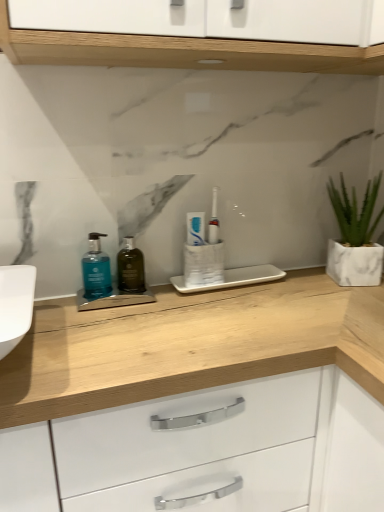
This screenshot has height=512, width=384. What are the coordinates of `white matte tube at center` in the screenshot? It's located at (195, 228).

The height and width of the screenshot is (512, 384). Find the location of `blue matte liquid soap at left, which is the 2th mouthwash in right-to-left order`. blue matte liquid soap at left, which is the 2th mouthwash in right-to-left order is located at coordinates (96, 269).

Describe the element at coordinates (96, 269) in the screenshot. The width and height of the screenshot is (384, 512). I see `blue matte liquid soap at left, which is the 2th mouthwash in right-to-left order` at that location.

I want to click on dark green glass bottle at center, the 1th mouthwash when ordered from right to left, so click(x=130, y=268).

Where is `white matte tube at center`? The height and width of the screenshot is (512, 384). white matte tube at center is located at coordinates (195, 228).

From a real-world perspective, is white marble planter at right above or below blue matte liquid soap at left, which is the first mouthwash in left-to-right order?

From a real-world perspective, white marble planter at right is physically above blue matte liquid soap at left, which is the first mouthwash in left-to-right order.

Is white marble planter at right facing away from blue matte liquid soap at left, which is the 2th mouthwash in right-to-left order?

No, blue matte liquid soap at left, which is the 2th mouthwash in right-to-left order, is not at the back of white marble planter at right.

From the image's perspective, is white marble planter at right over blue matte liquid soap at left, which is the first mouthwash in left-to-right order?

Yes, from the image's perspective, white marble planter at right is above blue matte liquid soap at left, which is the first mouthwash in left-to-right order.

Which of these two, white marble planter at right or blue matte liquid soap at left, which is the first mouthwash in left-to-right order, is smaller?

blue matte liquid soap at left, which is the first mouthwash in left-to-right order, is smaller.

This screenshot has height=512, width=384. I want to click on toothpaste above the blue matte liquid soap at left, which is the first mouthwash in left-to-right order (from the image's perspective), so click(x=195, y=228).

Based on the photo, which object is thinner, blue matte liquid soap at left, which is the first mouthwash in left-to-right order, or white matte tube at center?

white matte tube at center is thinner.

Would you say blue matte liquid soap at left, which is the first mouthwash in left-to-right order, contains white matte tube at center?

No, white matte tube at center is located outside of blue matte liquid soap at left, which is the first mouthwash in left-to-right order.

You are a GUI agent. You are given a task and a screenshot of the screen. Output one action in this format:
    pyautogui.click(x=<x>, y=<y>)
    Task: Click on the mouthwash that is the 1st one below the white marble planter at right (from a real-world perspective)
    Image resolution: width=384 pixels, height=512 pixels.
    Given the screenshot: What is the action you would take?
    pyautogui.click(x=96, y=269)

From their relative heights in the image, would you say blue matte liquid soap at left, which is the 2th mouthwash in right-to-left order, is taller or shorter than white marble planter at right?

In the image, blue matte liquid soap at left, which is the 2th mouthwash in right-to-left order, appears to be shorter than white marble planter at right.

Can you confirm if blue matte liquid soap at left, which is the first mouthwash in left-to-right order, is positioned to the left of white marble planter at right?

Indeed, blue matte liquid soap at left, which is the first mouthwash in left-to-right order, is positioned on the left side of white marble planter at right.

In the image, is dark green glass bottle at center, positioned as the second mouthwash in left-to-right order, on the left side or the right side of blue matte liquid soap at left, which is the first mouthwash in left-to-right order?

Clearly, dark green glass bottle at center, positioned as the second mouthwash in left-to-right order, is on the right of blue matte liquid soap at left, which is the first mouthwash in left-to-right order, in the image.

The width and height of the screenshot is (384, 512). Find the location of `mouthwash located behind the blue matte liquid soap at left, which is the first mouthwash in left-to-right order`. mouthwash located behind the blue matte liquid soap at left, which is the first mouthwash in left-to-right order is located at coordinates (130, 268).

Consider the image. Considering the relative sizes of dark green glass bottle at center, positioned as the second mouthwash in left-to-right order, and blue matte liquid soap at left, which is the 2th mouthwash in right-to-left order, in the image provided, is dark green glass bottle at center, positioned as the second mouthwash in left-to-right order, thinner than blue matte liquid soap at left, which is the 2th mouthwash in right-to-left order,?

Correct, the width of dark green glass bottle at center, positioned as the second mouthwash in left-to-right order, is less than that of blue matte liquid soap at left, which is the 2th mouthwash in right-to-left order.

From a real-world perspective, is dark green glass bottle at center, positioned as the second mouthwash in left-to-right order, beneath blue matte liquid soap at left, which is the first mouthwash in left-to-right order?

Yes, from a real-world perspective, dark green glass bottle at center, positioned as the second mouthwash in left-to-right order, is under blue matte liquid soap at left, which is the first mouthwash in left-to-right order.

Is dark green glass bottle at center, positioned as the second mouthwash in left-to-right order, wider or thinner than white marble planter at right?

Considering their sizes, dark green glass bottle at center, positioned as the second mouthwash in left-to-right order, looks slimmer than white marble planter at right.

From a real-world perspective, is dark green glass bottle at center, positioned as the second mouthwash in left-to-right order, positioned under white marble planter at right based on gravity?

Yes, from a real-world perspective, dark green glass bottle at center, positioned as the second mouthwash in left-to-right order, is beneath white marble planter at right.

Is dark green glass bottle at center, positioned as the second mouthwash in left-to-right order, positioned behind white marble planter at right?

No.

Does white marble planter at right appear on the right side of dark green glass bottle at center, positioned as the second mouthwash in left-to-right order?

Yes, white marble planter at right is to the right of dark green glass bottle at center, positioned as the second mouthwash in left-to-right order.

Which is correct: white marble planter at right is inside dark green glass bottle at center, the 1th mouthwash when ordered from right to left, or outside of it?

white marble planter at right is spatially situated outside dark green glass bottle at center, the 1th mouthwash when ordered from right to left.

Relative to dark green glass bottle at center, the 1th mouthwash when ordered from right to left, is white marble planter at right in front or behind?

Clearly, white marble planter at right is behind dark green glass bottle at center, the 1th mouthwash when ordered from right to left.

Is point (332, 252) in front of point (140, 287)?

No, (332, 252) is further to viewer.

How distant is dark green glass bottle at center, positioned as the second mouthwash in left-to-right order, from white matte tube at center?

dark green glass bottle at center, positioned as the second mouthwash in left-to-right order, and white matte tube at center are 6.28 inches apart from each other.

Could you tell me if dark green glass bottle at center, positioned as the second mouthwash in left-to-right order, is facing white matte tube at center?

No, dark green glass bottle at center, positioned as the second mouthwash in left-to-right order, is not oriented towards white matte tube at center.

How different are the orientations of dark green glass bottle at center, the 1th mouthwash when ordered from right to left, and white matte tube at center in degrees?

The angular difference between dark green glass bottle at center, the 1th mouthwash when ordered from right to left, and white matte tube at center is 1.27 degrees.

From a real-world perspective, who is located lower, dark green glass bottle at center, the 1th mouthwash when ordered from right to left, or white matte tube at center?

From a 3D spatial view, dark green glass bottle at center, the 1th mouthwash when ordered from right to left, is below.

I want to click on houseplant above the blue matte liquid soap at left, which is the 2th mouthwash in right-to-left order (from a real-world perspective), so click(x=355, y=237).

Locate an element on the screen. This screenshot has height=512, width=384. toothpaste behind the blue matte liquid soap at left, which is the first mouthwash in left-to-right order is located at coordinates tap(195, 228).

Looking at the image, which one is located closer to white matte tube at center, white marble planter at right or dark green glass bottle at center, positioned as the second mouthwash in left-to-right order?

Based on the image, dark green glass bottle at center, positioned as the second mouthwash in left-to-right order, appears to be nearer to white matte tube at center.

From the image, which object appears to be farther from white matte tube at center, dark green glass bottle at center, positioned as the second mouthwash in left-to-right order, or white marble planter at right?

white marble planter at right lies further to white matte tube at center than the other object.

Based on their spatial positions, is dark green glass bottle at center, the 1th mouthwash when ordered from right to left, or white marble planter at right closer to blue matte liquid soap at left, which is the first mouthwash in left-to-right order?

dark green glass bottle at center, the 1th mouthwash when ordered from right to left, is positioned closer to the anchor blue matte liquid soap at left, which is the first mouthwash in left-to-right order.

Considering their positions, is white marble planter at right positioned further to dark green glass bottle at center, positioned as the second mouthwash in left-to-right order, than white matte tube at center?

white marble planter at right is positioned further to the anchor dark green glass bottle at center, positioned as the second mouthwash in left-to-right order.

From the image, which object appears to be farther from white matte tube at center, dark green glass bottle at center, positioned as the second mouthwash in left-to-right order, or blue matte liquid soap at left, which is the first mouthwash in left-to-right order?

The object further to white matte tube at center is blue matte liquid soap at left, which is the first mouthwash in left-to-right order.

Estimate the real-world distances between objects in this image. Which object is further from white marble planter at right, dark green glass bottle at center, the 1th mouthwash when ordered from right to left, or blue matte liquid soap at left, which is the first mouthwash in left-to-right order?

The object further to white marble planter at right is blue matte liquid soap at left, which is the first mouthwash in left-to-right order.

From the picture: When comparing their distances from white marble planter at right, does white matte tube at center or blue matte liquid soap at left, which is the first mouthwash in left-to-right order, seem further?

blue matte liquid soap at left, which is the first mouthwash in left-to-right order.

Based on the photo, estimate the real-world distances between objects in this image. Which object is further from dark green glass bottle at center, positioned as the second mouthwash in left-to-right order, blue matte liquid soap at left, which is the 2th mouthwash in right-to-left order, or white matte tube at center?

Among the two, white matte tube at center is located further to dark green glass bottle at center, positioned as the second mouthwash in left-to-right order.

Where is `mouthwash between blue matte liquid soap at left, which is the first mouthwash in left-to-right order, and white matte tube at center, in the horizontal direction`? mouthwash between blue matte liquid soap at left, which is the first mouthwash in left-to-right order, and white matte tube at center, in the horizontal direction is located at coordinates (130, 268).

You are a GUI agent. You are given a task and a screenshot of the screen. Output one action in this format:
    pyautogui.click(x=<x>, y=<y>)
    Task: Click on the mouthwash between blue matte liquid soap at left, which is the first mouthwash in left-to-right order, and white marble planter at right from left to right
    The width and height of the screenshot is (384, 512).
    Given the screenshot: What is the action you would take?
    pyautogui.click(x=130, y=268)

Image resolution: width=384 pixels, height=512 pixels. In order to click on toothpaste situated between blue matte liquid soap at left, which is the 2th mouthwash in right-to-left order, and white marble planter at right from left to right in this screenshot , I will do `click(195, 228)`.

Where is `toothpaste between dark green glass bottle at center, positioned as the second mouthwash in left-to-right order, and white marble planter at right`? The image size is (384, 512). toothpaste between dark green glass bottle at center, positioned as the second mouthwash in left-to-right order, and white marble planter at right is located at coordinates (195, 228).